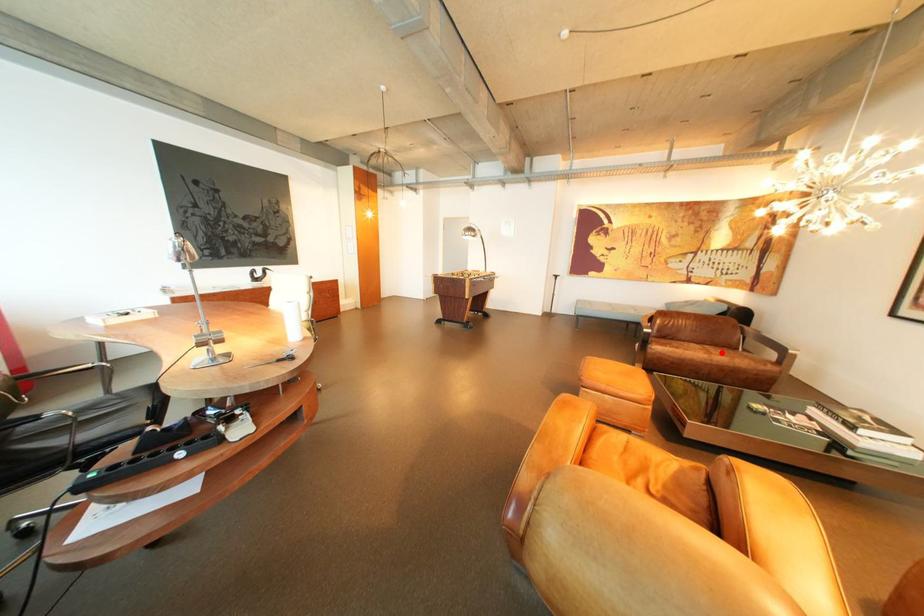
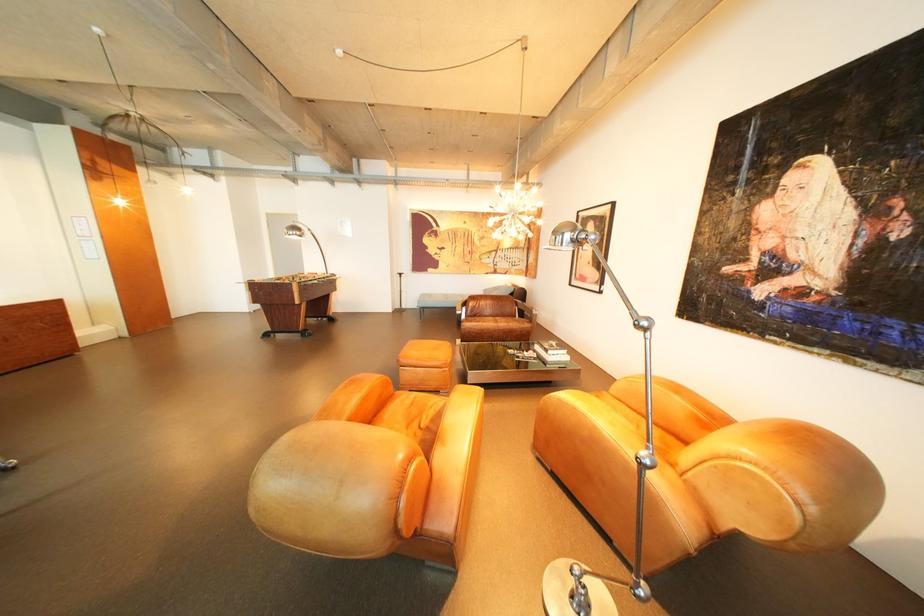
Find the pixel in the second image that matches the highlighted location in the first image.

(509, 322)